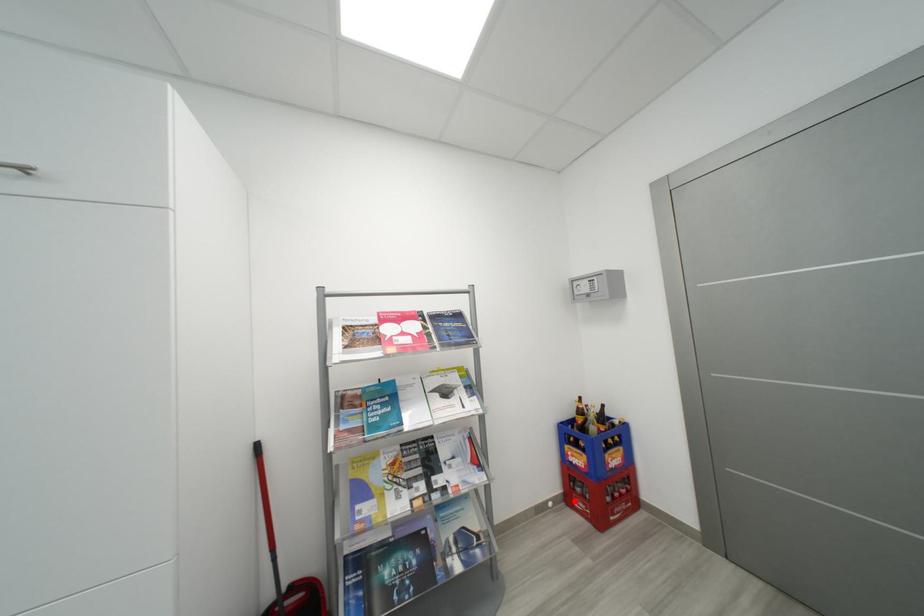
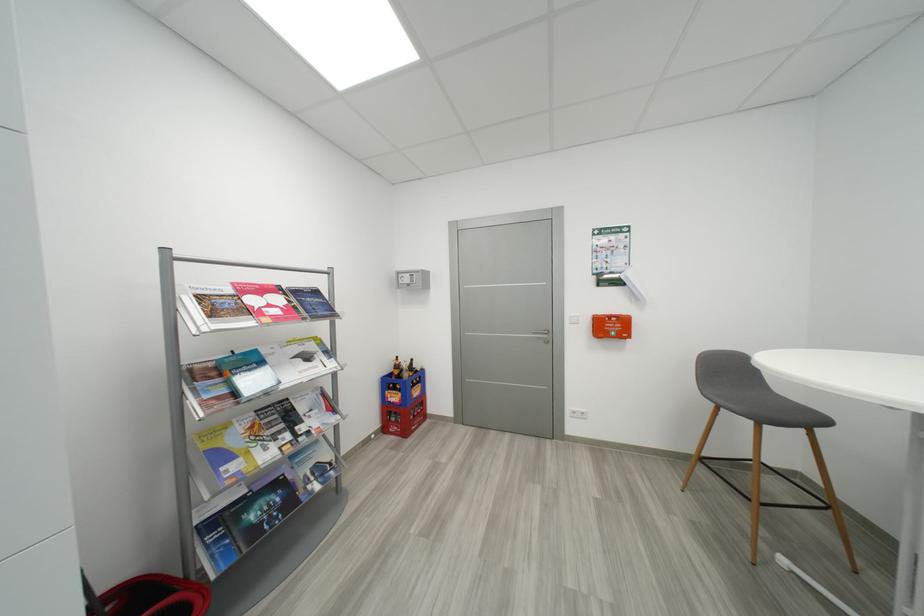
Question: A red point is marked in image1. In image2, is the corresponding 3D point closer to the camera or farther? Reply with the corresponding letter.

Choices:
 (A) The corresponding 3D point is closer.
 (B) The corresponding 3D point is farther.

Answer: (B)